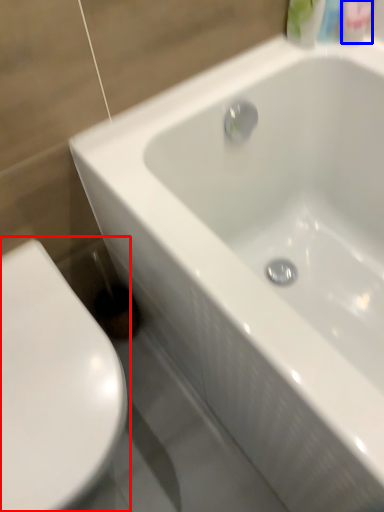
Question: Among these objects, which one is nearest to the camera, toilet (highlighted by a red box) or mouthwash (highlighted by a blue box)?

Choices:
 (A) toilet
 (B) mouthwash

Answer: (A)